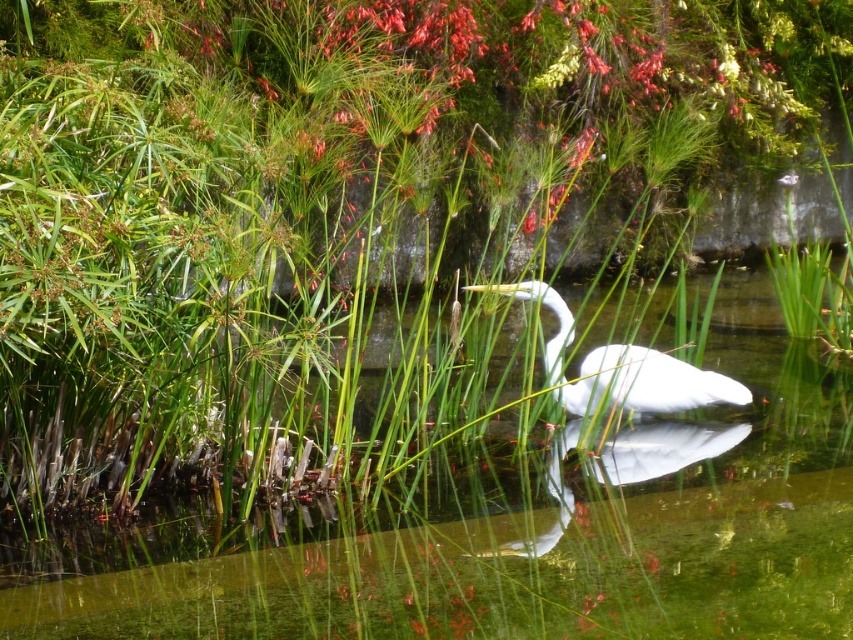
Question: Can you confirm if clear water at center is bigger than white feathered bird at center?

Choices:
 (A) yes
 (B) no

Answer: (A)

Question: Does clear water at center come behind white feathered bird at center?

Choices:
 (A) yes
 (B) no

Answer: (B)

Question: In this image, where is clear water at center located relative to white feathered bird at center?

Choices:
 (A) below
 (B) above

Answer: (A)

Question: Which point appears closest to the camera in this image?

Choices:
 (A) (636, 538)
 (B) (727, 388)

Answer: (A)